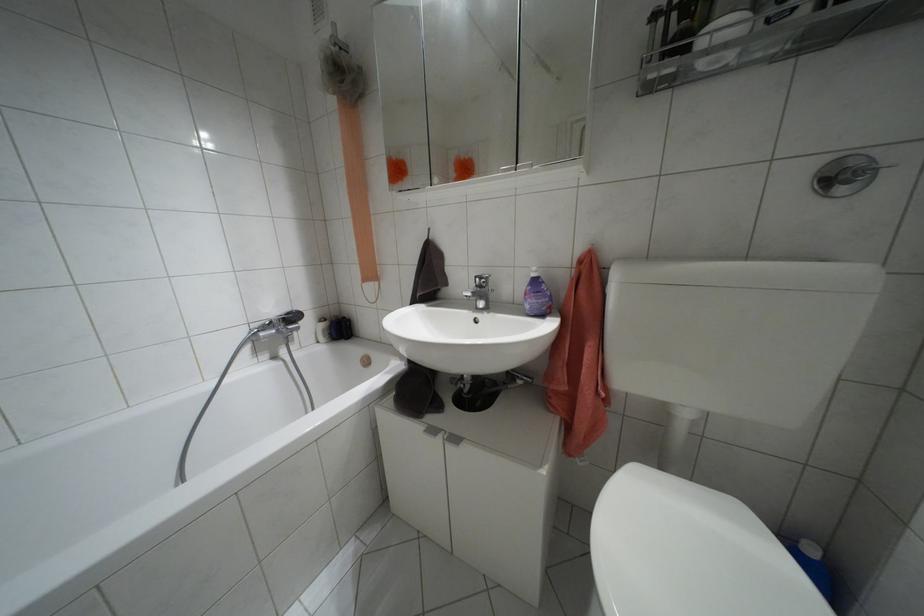
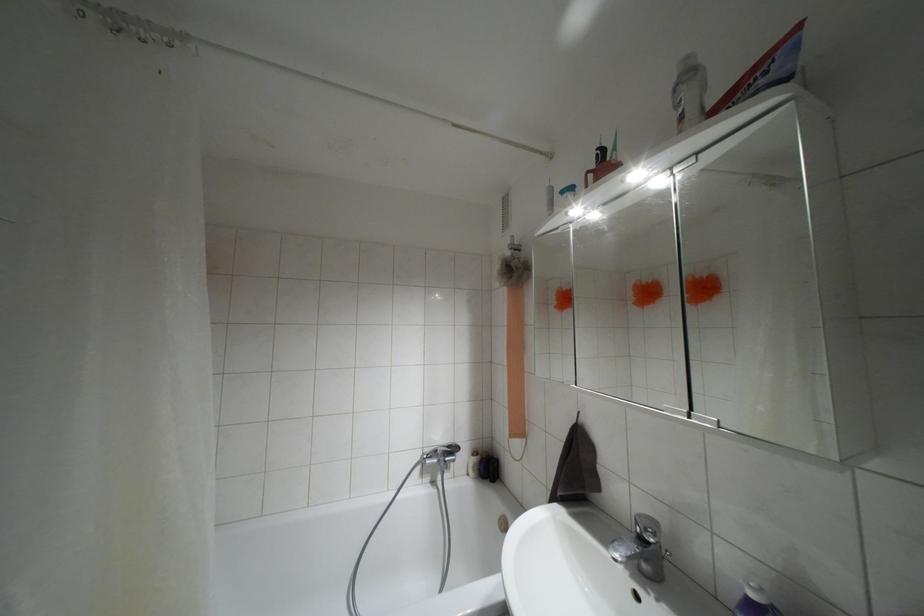
Question: I am providing you with two images of the same scene from different viewpoints. Please identify which objects are invisible in image2.

Choices:
 (A) sink faucet handle
 (B) cabinet door handle
 (C) beige shower pouf
 (D) none of these

Answer: (D)